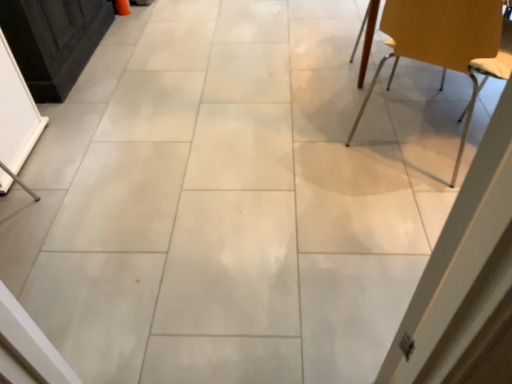
The height and width of the screenshot is (384, 512). What do you see at coordinates (446, 44) in the screenshot?
I see `wooden chair at right` at bounding box center [446, 44].

Where is `wooden chair at right`? This screenshot has height=384, width=512. wooden chair at right is located at coordinates (446, 44).

I want to click on wooden chair at right, so click(x=446, y=44).